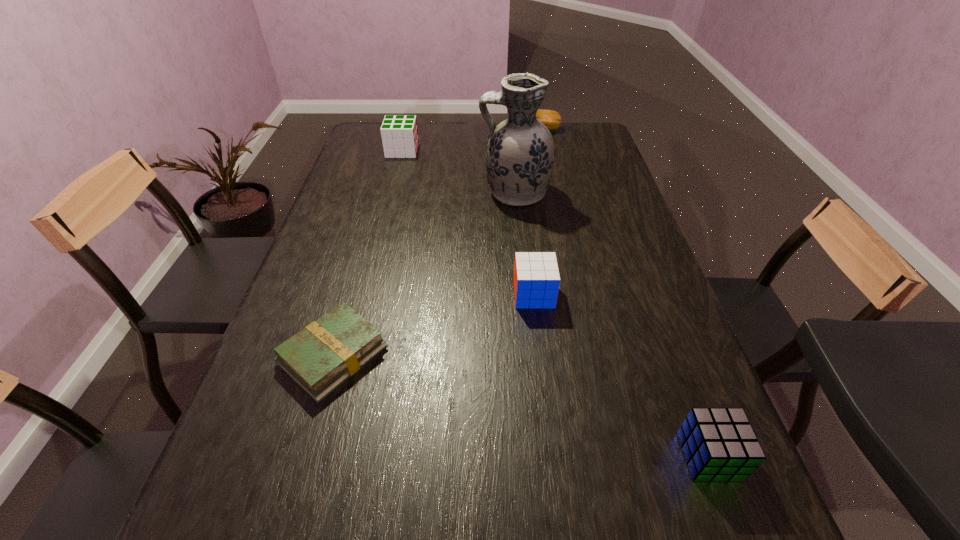
Locate an element on the screen. The height and width of the screenshot is (540, 960). the third farthest object is located at coordinates (520, 152).

I want to click on vase, so click(520, 152).

Locate an element on the screen. the farthest cube is located at coordinates (399, 133).

The image size is (960, 540). What are the coordinates of `the leftmost cube` in the screenshot? It's located at (399, 133).

The image size is (960, 540). I want to click on gourd, so click(551, 119).

At what (x,y) coordinates should I click in order to perform the action: click on the second cube from left to right. Please return your answer as a coordinate pair (x, y). Looking at the image, I should click on (536, 280).

The height and width of the screenshot is (540, 960). In order to click on the second farthest cube in this screenshot , I will do `click(536, 280)`.

Identify the location of the rightmost object. (719, 444).

Image resolution: width=960 pixels, height=540 pixels. Identify the location of the nearest object. (719, 444).

Image resolution: width=960 pixels, height=540 pixels. Identify the location of the fifth farthest object. (319, 358).